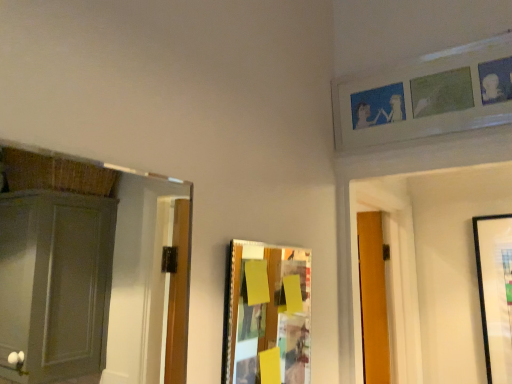
Question: Considering the relative positions of white matte picture frame at upper right, placed as the 2th picture frame when sorted from bottom to top, and wooden collage board at center, marked as the first picture frame in a front-to-back arrangement, in the image provided, is white matte picture frame at upper right, placed as the 2th picture frame when sorted from bottom to top, to the left or to the right of wooden collage board at center, marked as the first picture frame in a front-to-back arrangement,?

Choices:
 (A) right
 (B) left

Answer: (A)

Question: Is point (395, 122) closer or farther from the camera than point (285, 294)?

Choices:
 (A) farther
 (B) closer

Answer: (A)

Question: From a real-world perspective, is white matte picture frame at upper right, positioned as the 1th picture frame in back-to-front order, positioned above or below wooden collage board at center, the 2th picture frame positioned from the top?

Choices:
 (A) below
 (B) above

Answer: (B)

Question: Is point (254, 350) closer or farther from the camera than point (439, 105)?

Choices:
 (A) closer
 (B) farther

Answer: (A)

Question: Is wooden collage board at center, which ranks as the 2th picture frame in right-to-left order, taller or shorter than white matte picture frame at upper right, marked as the first picture frame in a top-to-bottom arrangement?

Choices:
 (A) tall
 (B) short

Answer: (A)

Question: In the image, is wooden collage board at center, marked as the first picture frame in a bottom-to-top arrangement, on the left side or the right side of white matte picture frame at upper right, marked as the 2th picture frame in a front-to-back arrangement?

Choices:
 (A) right
 (B) left

Answer: (B)

Question: Is wooden collage board at center, marked as the first picture frame in a bottom-to-top arrangement, wider or thinner than white matte picture frame at upper right, placed as the 2th picture frame when sorted from bottom to top?

Choices:
 (A) wide
 (B) thin

Answer: (B)